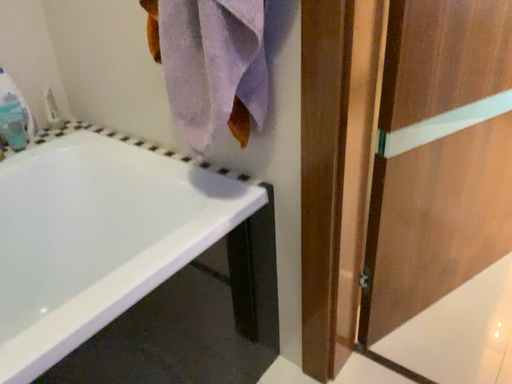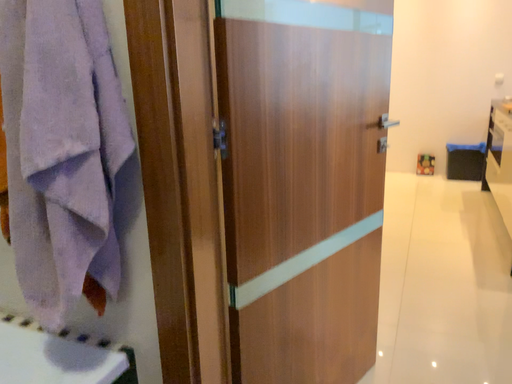
Question: Which way did the camera rotate in the video?

Choices:
 (A) rotated upward
 (B) rotated downward

Answer: (A)